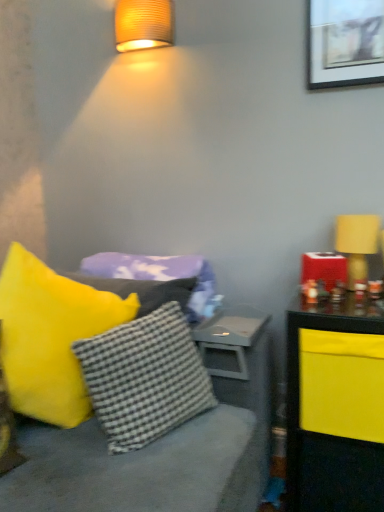
Question: Is yellow fabric pillow at left, which is the first pillow from front to back, inside or outside of yellow fabric lampshade at right?

Choices:
 (A) inside
 (B) outside

Answer: (B)

Question: Considering the positions of yellow fabric pillow at left, which is counted as the 3th pillow, starting from the back, and yellow fabric lampshade at right in the image, is yellow fabric pillow at left, which is counted as the 3th pillow, starting from the back, bigger or smaller than yellow fabric lampshade at right?

Choices:
 (A) big
 (B) small

Answer: (A)

Question: Estimate the real-world distances between objects in this image. Which object is farther from the matte white picture frame at upper right?

Choices:
 (A) yellow fabric lampshade at right
 (B) gray matte table at center
 (C) soft purple pillow at center, the 3th pillow from the front
 (D) matte ribbed lampshade at upper left
 (E) yellow fabric pillow at left, which is counted as the 3th pillow, starting from the back

Answer: (E)

Question: Estimate the real-world distances between objects in this image. Which object is farther from the soft purple pillow at center, placed as the first pillow when sorted from back to front?

Choices:
 (A) yellow fabric pillow at left, which is counted as the 3th pillow, starting from the back
 (B) matte white picture frame at upper right
 (C) checkered fabric pillow at center, which is the 2th pillow in front-to-back order
 (D) matte ribbed lampshade at upper left
 (E) yellow fabric lampshade at right

Answer: (B)